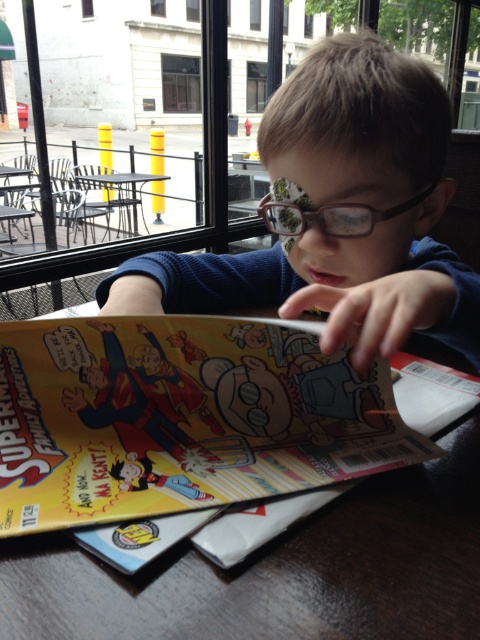
Is brown plastic glasses at center smaller than metallic gray table at center?

Correct, brown plastic glasses at center occupies less space than metallic gray table at center.

Does point (351, 221) lie in front of point (96, 177)?

Yes, it is in front of point (96, 177).

Find the location of `brown plastic glasses at center`. brown plastic glasses at center is located at coordinates (331, 216).

Does brown matte glasses at center have a smaller size compared to metallic gray table at center?

Yes.

Does brown matte glasses at center have a lesser width compared to metallic gray table at center?

Yes.

Between point (314, 148) and point (97, 180), which one is positioned behind?

Positioned behind is point (97, 180).

Find the location of a particular element. This screenshot has width=480, height=640. brown matte glasses at center is located at coordinates (337, 212).

Who is more distant from viewer, (384, 307) or (308, 209)?

Positioned behind is point (308, 209).

Looking at this image, which is more to the right, brown matte glasses at center or brown plastic glasses at center?

Positioned to the right is brown matte glasses at center.

Image resolution: width=480 pixels, height=640 pixels. I want to click on brown matte glasses at center, so click(x=337, y=212).